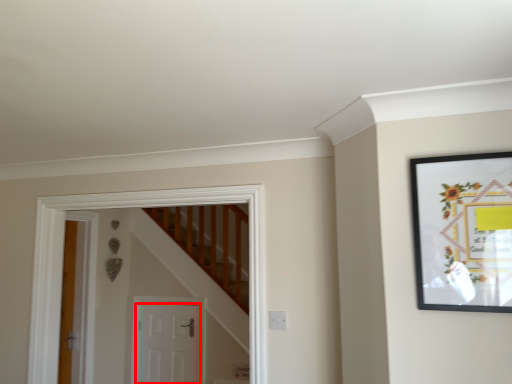
Question: Considering the relative positions of door (annotated by the red box) and picture frame in the image provided, where is door (annotated by the red box) located with respect to the staircase?

Choices:
 (A) right
 (B) left

Answer: (B)